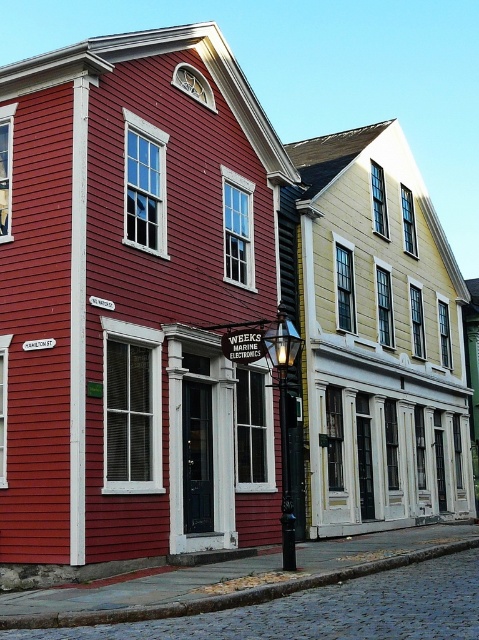
You are an architect examining the two historic buildings on Hamilton St. You notice both have white wood trim at upper center and white wood trim at center. Which of these trims is narrower?

The white wood trim at upper center is thinner than the white wood trim at center, so the white wood trim at upper center is narrower.

You are a painter standing on a ladder in the middle of the street, looking at the two historic buildings. You need to touch both the white wood trim at upper center and the white wood trim at center. Which one will you reach first?

The white wood trim at upper center is closer to the viewer than the white wood trim at center, so you will reach the white wood trim at upper center first.